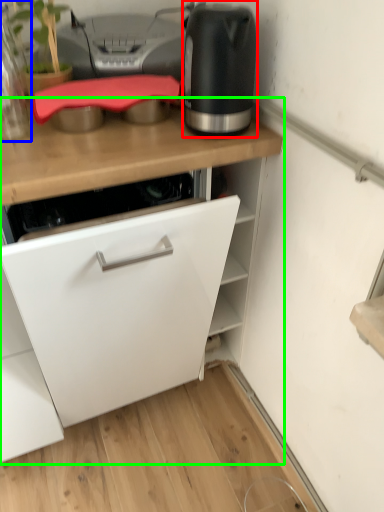
Question: Considering the real-world distances, which object is closest to home appliance (highlighted by a red box)? kitchen appliance (highlighted by a blue box) or cabinetry (highlighted by a green box).

Choices:
 (A) kitchen appliance
 (B) cabinetry

Answer: (B)